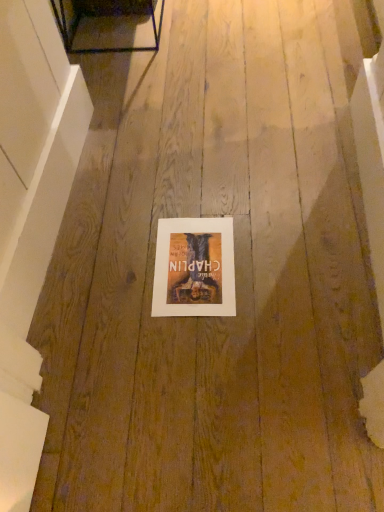
Question: Is matte paper poster at center bigger than white smooth wall at left?

Choices:
 (A) no
 (B) yes

Answer: (A)

Question: Does matte paper poster at center have a lesser height compared to white smooth wall at left?

Choices:
 (A) yes
 (B) no

Answer: (A)

Question: Is matte paper poster at center looking in the opposite direction of white smooth wall at left?

Choices:
 (A) yes
 (B) no

Answer: (B)

Question: Is matte paper poster at center to the left of white smooth wall at left from the viewer's perspective?

Choices:
 (A) yes
 (B) no

Answer: (B)

Question: From a real-world perspective, is matte paper poster at center located higher than white smooth wall at left?

Choices:
 (A) no
 (B) yes

Answer: (A)

Question: Is matte paper poster at center thinner than white smooth wall at left?

Choices:
 (A) yes
 (B) no

Answer: (B)

Question: Does white smooth wall at left lie in front of matte paper poster at center?

Choices:
 (A) no
 (B) yes

Answer: (B)

Question: Does white smooth wall at left lie behind matte paper poster at center?

Choices:
 (A) yes
 (B) no

Answer: (B)

Question: Considering the relative sizes of white smooth wall at left and matte paper poster at center in the image provided, is white smooth wall at left shorter than matte paper poster at center?

Choices:
 (A) no
 (B) yes

Answer: (A)

Question: Considering the relative positions of white smooth wall at left and matte paper poster at center in the image provided, is white smooth wall at left to the left of matte paper poster at center from the viewer's perspective?

Choices:
 (A) yes
 (B) no

Answer: (A)

Question: From the image's perspective, does white smooth wall at left appear lower than matte paper poster at center?

Choices:
 (A) no
 (B) yes

Answer: (A)

Question: Is white smooth wall at left positioned with its back to matte paper poster at center?

Choices:
 (A) no
 (B) yes

Answer: (A)

Question: From the image's perspective, relative to matte paper poster at center, is white smooth wall at left above or below?

Choices:
 (A) above
 (B) below

Answer: (A)